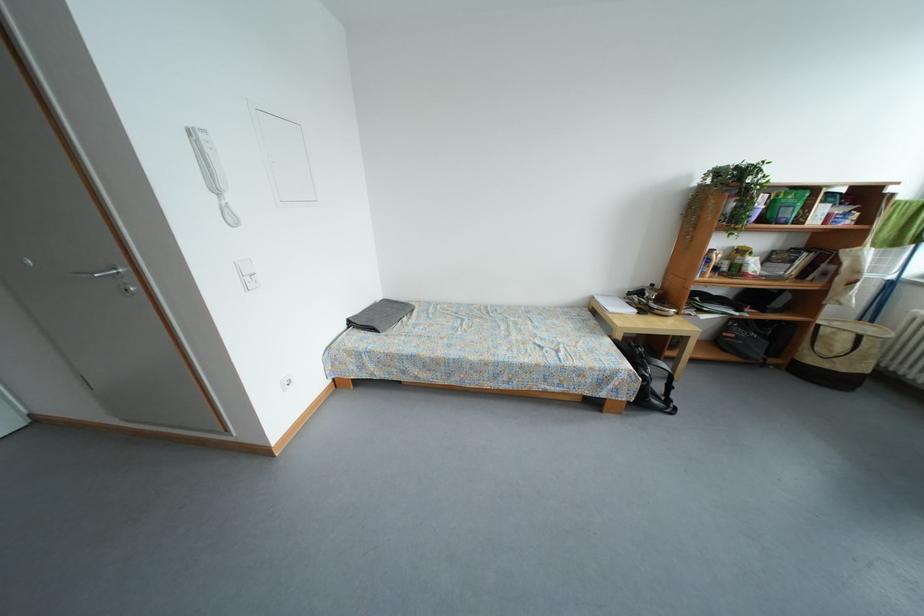
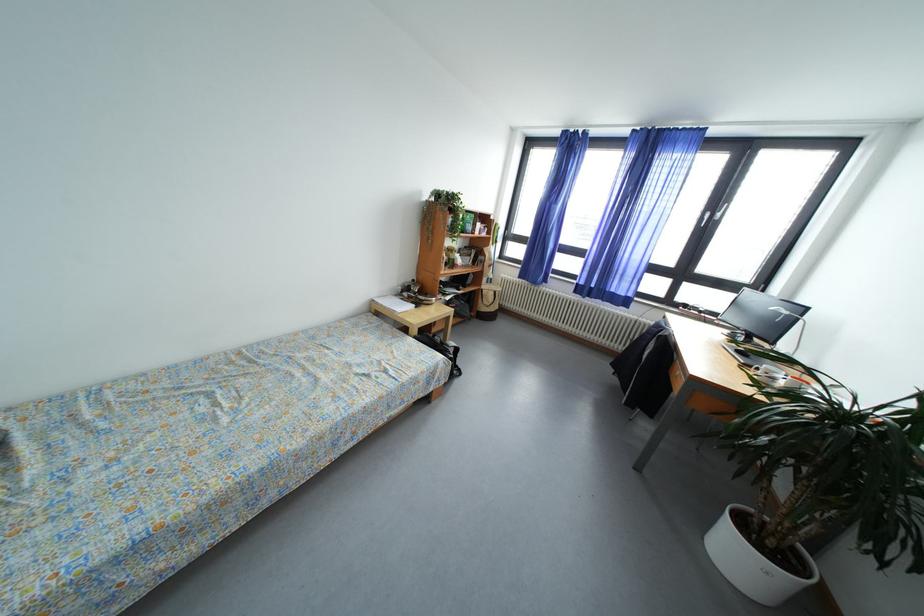
In the second image, find the point that corresponds to the point at 625,341 in the first image.

(421, 337)